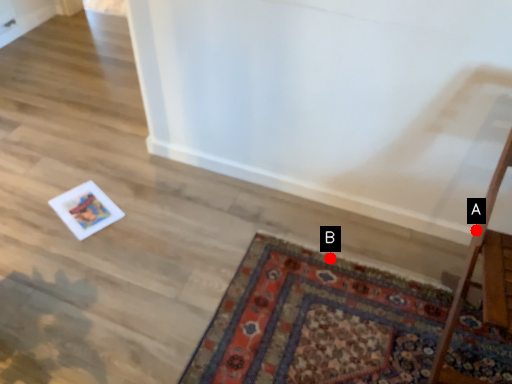
Question: Two points are circled on the image, labeled by A and B beside each circle. Which point is farther to the camera?

Choices:
 (A) A is further
 (B) B is further

Answer: (B)